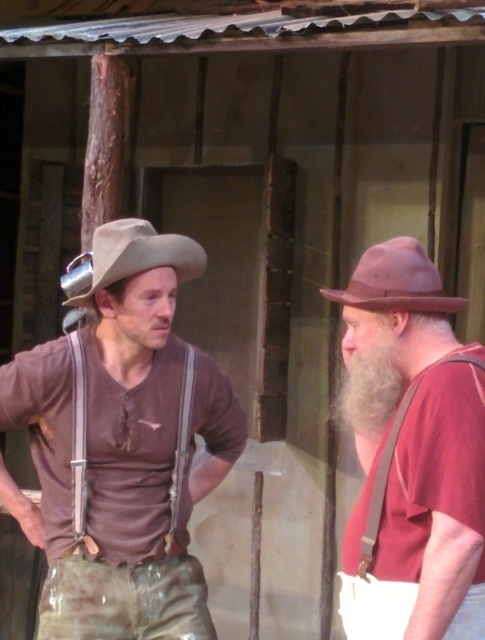
Question: Is brown leather suspenders at right to the right of brown fabric suspenders at left from the viewer's perspective?

Choices:
 (A) no
 (B) yes

Answer: (B)

Question: Based on their relative distances, which object is farther from the matte brown shirt at left?

Choices:
 (A) matte brown hat at center
 (B) brown suede hat at right

Answer: (B)

Question: Is brown suede hat at right positioned behind pink felt hat at right?

Choices:
 (A) no
 (B) yes

Answer: (B)

Question: Which point is closer to the camera?

Choices:
 (A) white soft beard at right
 (B) brown fabric suspenders at left

Answer: (A)

Question: Can you confirm if matte brown hat at center is positioned to the left of white soft beard at right?

Choices:
 (A) yes
 (B) no

Answer: (A)

Question: Which of these objects is positioned farthest from the matte brown shirt at left?

Choices:
 (A) white soft beard at right
 (B) brown leather suspenders at right
 (C) pink felt hat at right

Answer: (C)